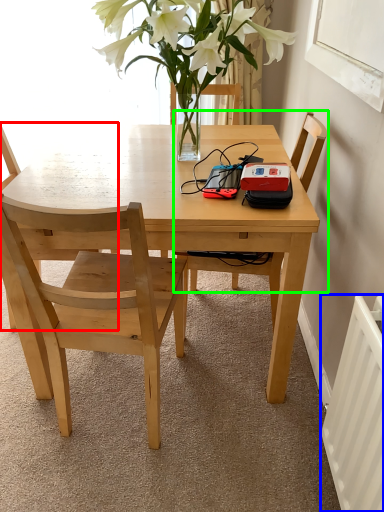
Question: Estimate the real-world distances between objects in this image. Which object is farther from chair (highlighted by a red box), radiator (highlighted by a blue box) or chair (highlighted by a green box)?

Choices:
 (A) radiator
 (B) chair

Answer: (A)